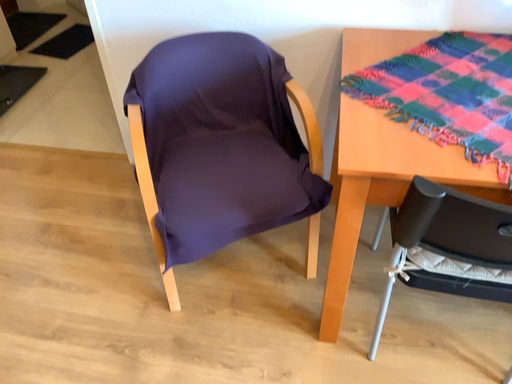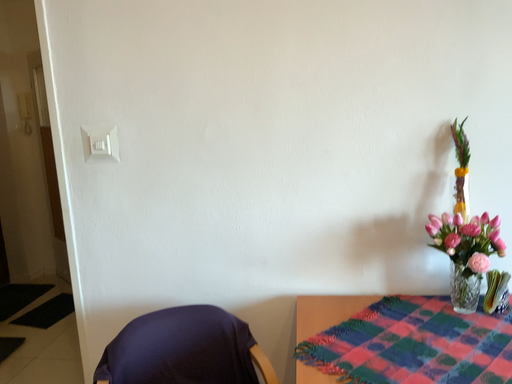
Question: How did the camera likely rotate when shooting the video?

Choices:
 (A) rotated downward
 (B) rotated upward

Answer: (B)